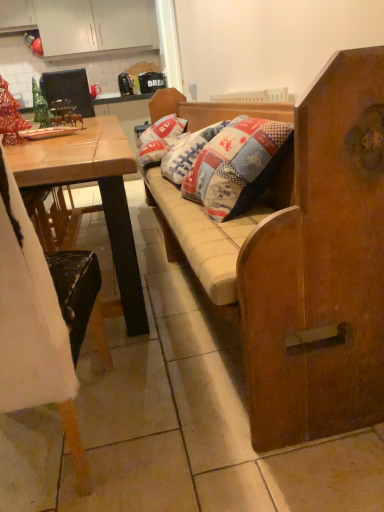
Question: Does patchwork fabric pillow at center have a lesser height compared to wooden cushioned bench at center?

Choices:
 (A) yes
 (B) no

Answer: (A)

Question: Does patchwork fabric pillow at center appear on the left side of wooden cushioned bench at center?

Choices:
 (A) no
 (B) yes

Answer: (B)

Question: Is patchwork fabric pillow at center positioned far away from wooden cushioned bench at center?

Choices:
 (A) no
 (B) yes

Answer: (B)

Question: Is patchwork fabric pillow at center to the right of wooden cushioned bench at center from the viewer's perspective?

Choices:
 (A) no
 (B) yes

Answer: (A)

Question: Does patchwork fabric pillow at center come in front of wooden cushioned bench at center?

Choices:
 (A) no
 (B) yes

Answer: (A)

Question: Does point (79, 16) appear closer or farther from the camera than point (86, 91)?

Choices:
 (A) closer
 (B) farther

Answer: (B)

Question: Is white matte cabinet at upper left taller or shorter than metallic black armchair at upper left?

Choices:
 (A) short
 (B) tall

Answer: (B)

Question: From a real-world perspective, is white matte cabinet at upper left positioned above or below metallic black armchair at upper left?

Choices:
 (A) below
 (B) above

Answer: (B)

Question: Is white matte cabinet at upper left bigger or smaller than metallic black armchair at upper left?

Choices:
 (A) small
 (B) big

Answer: (B)

Question: Considering the positions of patchwork fabric pillow at center and wooden desk at left in the image, is patchwork fabric pillow at center bigger or smaller than wooden desk at left?

Choices:
 (A) small
 (B) big

Answer: (A)

Question: Is patchwork fabric pillow at center to the left or to the right of wooden desk at left in the image?

Choices:
 (A) right
 (B) left

Answer: (A)

Question: From a real-world perspective, is patchwork fabric pillow at center positioned above or below wooden desk at left?

Choices:
 (A) below
 (B) above

Answer: (B)

Question: Is patchwork fabric pillow at center wider or thinner than wooden desk at left?

Choices:
 (A) thin
 (B) wide

Answer: (A)

Question: In terms of width, does metallic green ornament at upper left look wider or thinner when compared to wooden chair at left?

Choices:
 (A) thin
 (B) wide

Answer: (A)

Question: Do you think metallic green ornament at upper left is within wooden chair at left, or outside of it?

Choices:
 (A) inside
 (B) outside

Answer: (B)